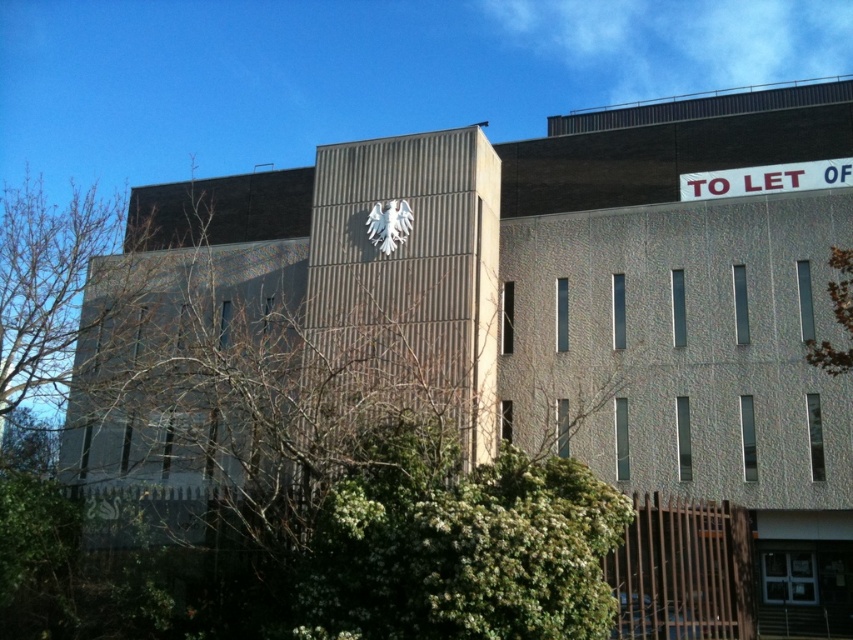
Question: Which of these objects is positioned farthest from the white matte eagle at upper center?

Choices:
 (A) green leafy tree at right
 (B) green leafy tree at upper center

Answer: (A)

Question: Where is green leafy tree at right located in relation to white matte eagle at upper center in the image?

Choices:
 (A) below
 (B) above

Answer: (A)

Question: Is green leafy tree at upper center smaller than white matte eagle at upper center?

Choices:
 (A) yes
 (B) no

Answer: (B)

Question: Which object is closer to the camera taking this photo?

Choices:
 (A) green leafy tree at right
 (B) white matte eagle at upper center
 (C) green leafy tree at upper center

Answer: (C)

Question: Which of these objects is positioned closest to the white matte eagle at upper center?

Choices:
 (A) green leafy tree at upper center
 (B) green leafy tree at right

Answer: (A)

Question: Does green leafy tree at upper center have a lesser width compared to green leafy tree at right?

Choices:
 (A) no
 (B) yes

Answer: (A)